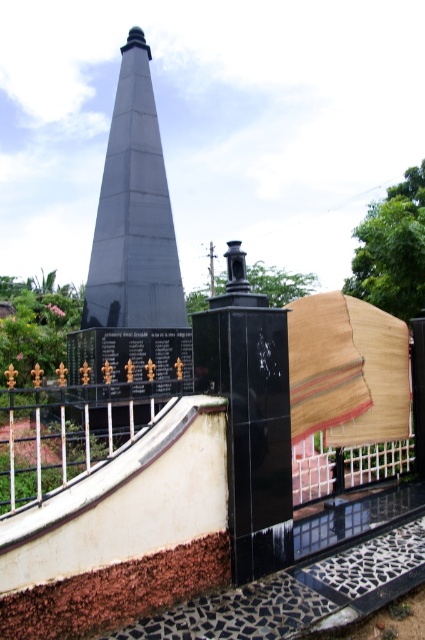
Question: Is smooth gray obelisk at center to the right of gold wrought iron railing at lower left from the viewer's perspective?

Choices:
 (A) yes
 (B) no

Answer: (B)

Question: Does smooth gray obelisk at center appear on the right side of gold wrought iron railing at lower left?

Choices:
 (A) yes
 (B) no

Answer: (B)

Question: Is smooth gray obelisk at center closer to camera compared to gold wrought iron railing at lower left?

Choices:
 (A) no
 (B) yes

Answer: (A)